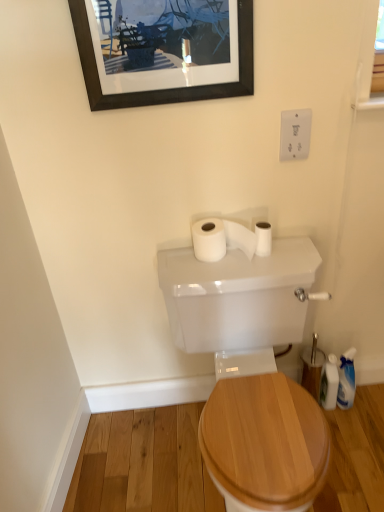
Question: Is white plastic bottle at lower right not close to white matte toilet paper at upper center, which appears as the first toilet paper when viewed from the left?

Choices:
 (A) yes
 (B) no

Answer: (B)

Question: Does white plastic bottle at lower right lie in front of white matte toilet paper at upper center, which appears as the first toilet paper when viewed from the left?

Choices:
 (A) yes
 (B) no

Answer: (B)

Question: From a real-world perspective, does white plastic bottle at lower right sit lower than white matte toilet paper at upper center, which appears as the 2th toilet paper when viewed from the right?

Choices:
 (A) no
 (B) yes

Answer: (B)

Question: Does white plastic bottle at lower right come behind white matte toilet paper at upper center, which appears as the first toilet paper when viewed from the left?

Choices:
 (A) no
 (B) yes

Answer: (B)

Question: From a real-world perspective, is white plastic bottle at lower right positioned over white matte toilet paper at upper center, which appears as the first toilet paper when viewed from the left, based on gravity?

Choices:
 (A) yes
 (B) no

Answer: (B)

Question: Considering the relative sizes of white plastic bottle at lower right and white matte toilet paper at upper center, which appears as the first toilet paper when viewed from the left, in the image provided, is white plastic bottle at lower right thinner than white matte toilet paper at upper center, which appears as the first toilet paper when viewed from the left,?

Choices:
 (A) no
 (B) yes

Answer: (B)

Question: Is white matte toilet paper at upper center, the second toilet paper in the left-to-right sequence, behind white glossy toilet tank at center?

Choices:
 (A) no
 (B) yes

Answer: (B)

Question: From a real-world perspective, is white matte toilet paper at upper center, placed as the 1th toilet paper when sorted from right to left, located higher than white glossy toilet tank at center?

Choices:
 (A) no
 (B) yes

Answer: (B)

Question: Is white matte toilet paper at upper center, the second toilet paper in the left-to-right sequence, turned away from white glossy toilet tank at center?

Choices:
 (A) no
 (B) yes

Answer: (A)

Question: Considering the relative positions of white matte toilet paper at upper center, placed as the 1th toilet paper when sorted from right to left, and white glossy toilet tank at center in the image provided, is white matte toilet paper at upper center, placed as the 1th toilet paper when sorted from right to left, to the right of white glossy toilet tank at center from the viewer's perspective?

Choices:
 (A) yes
 (B) no

Answer: (A)

Question: Is white matte toilet paper at upper center, the second toilet paper in the left-to-right sequence, aimed at white glossy toilet tank at center?

Choices:
 (A) no
 (B) yes

Answer: (A)

Question: Can you confirm if white matte toilet paper at upper center, the second toilet paper in the left-to-right sequence, is positioned to the left of white glossy toilet tank at center?

Choices:
 (A) no
 (B) yes

Answer: (A)

Question: Would you say white plastic bottle at lower right is a long distance from white plastic outlet at upper right?

Choices:
 (A) no
 (B) yes

Answer: (A)